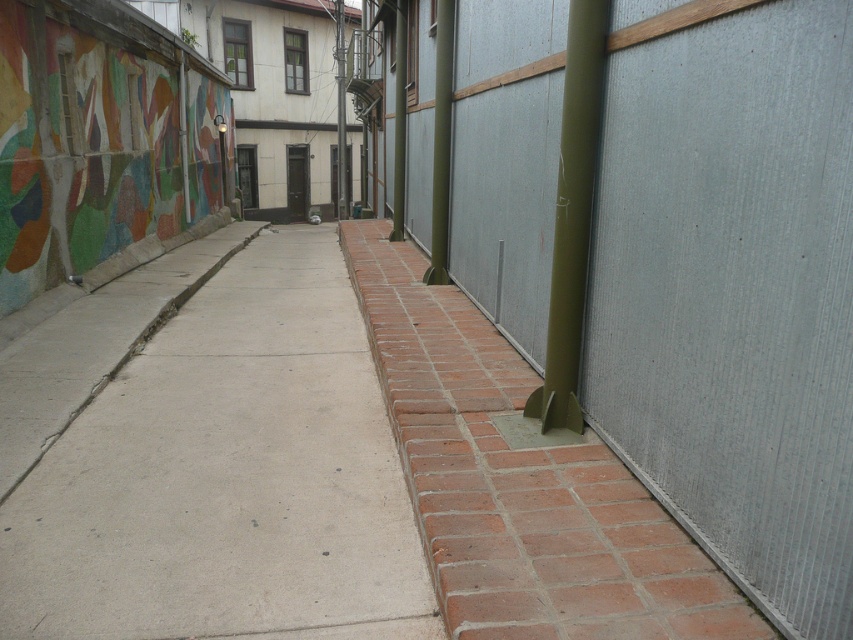
Question: Can you confirm if green corrugated metal fence at center-right is positioned to the right of concrete at center?

Choices:
 (A) yes
 (B) no

Answer: (A)

Question: Is green corrugated metal fence at center-right to the left of concrete at center from the viewer's perspective?

Choices:
 (A) no
 (B) yes

Answer: (A)

Question: Where is green corrugated metal fence at center-right located in relation to concrete at center in the image?

Choices:
 (A) below
 (B) above

Answer: (B)

Question: Which of the following is the farthest from the observer?

Choices:
 (A) (312, 426)
 (B) (392, 45)

Answer: (B)

Question: Which object appears farthest from the camera in this image?

Choices:
 (A) concrete at center
 (B) green corrugated metal fence at center-right

Answer: (A)